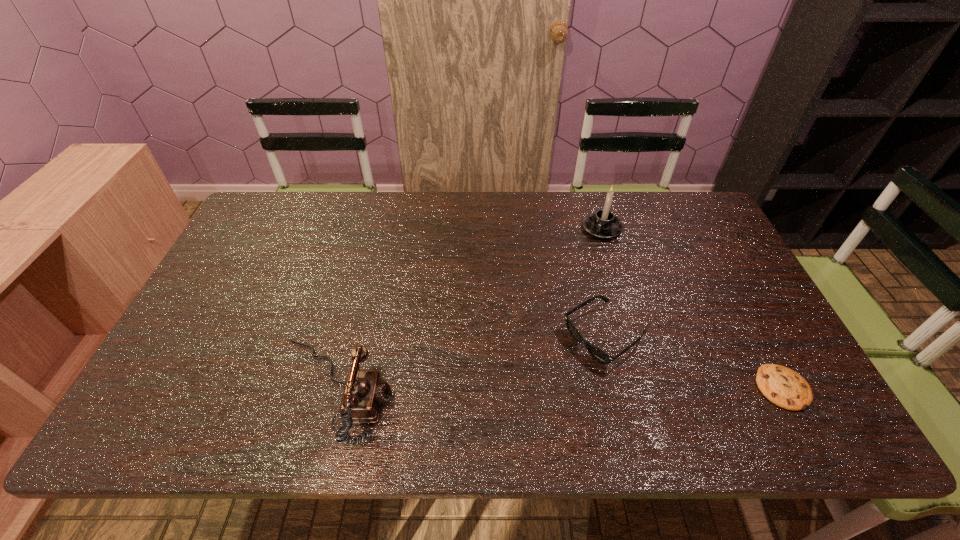
Where is `free area in between the shortest object and the sunglasses`? The height and width of the screenshot is (540, 960). free area in between the shortest object and the sunglasses is located at coordinates (693, 362).

In order to click on vacant area that lies between the sunglasses and the leftmost object in this screenshot , I will do `click(468, 363)`.

This screenshot has height=540, width=960. Find the location of `free point between the third shortest object and the sunglasses`. free point between the third shortest object and the sunglasses is located at coordinates (468, 363).

Locate an element on the screen. The image size is (960, 540). free space between the third tallest object and the farthest object is located at coordinates (603, 282).

Find the location of a particular element. object that is the closest to the shortest object is located at coordinates (598, 354).

Choose which object is the second nearest neighbor to the rightmost object. Please provide its 2D coordinates. Your answer should be formatted as a tuple, i.e. [(x, y)], where the tuple contains the x and y coordinates of a point satisfying the conditions above.

[(603, 224)]